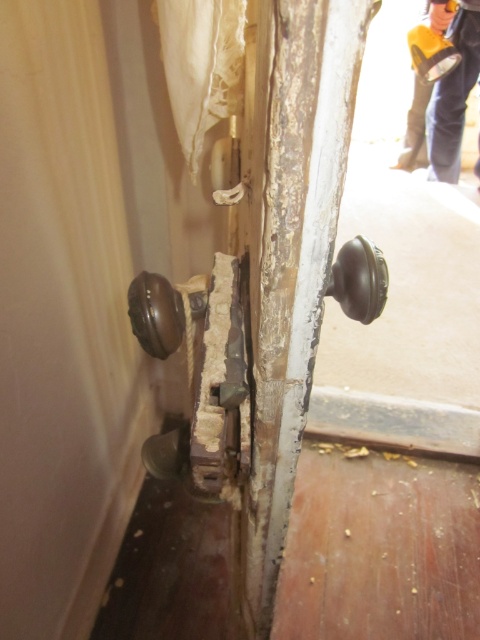
You are a maintenance worker who needs to reach both the matte brown door handle at center and the orange fabric pants at upper right. Given that your ladder can extend up to 9 feet, will you be able to safely reach both objects without moving the ladder?

The matte brown door handle at center and orange fabric pants at upper right are 9.25 feet apart from each other. Since the ladder can only extend up to 9 feet, the distance between the two objects exceeds the ladder height. Therefore, you cannot safely reach both objects without moving the ladder.

You are a door inspector checking the knobs on this partially opened wooden door. You need to determine which knob is larger. The door has a shiny dark brown knob at right and a shiny dark brown knob at lower left. Which one is larger?

The shiny dark brown knob at right is bigger than the shiny dark brown knob at lower left according to the description.

You are a repair technician assessing the door. You see the point at coordinates (252, 348). Which object is this point located on?

The point at coordinates (252, 348) is located on the matte brown door handle at center.